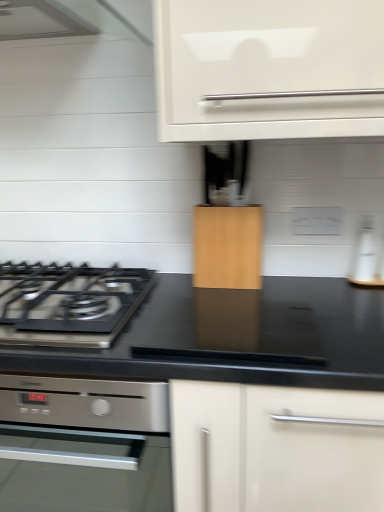
This screenshot has width=384, height=512. Describe the element at coordinates (228, 247) in the screenshot. I see `wooden cabinet at center` at that location.

What are the coordinates of `white glossy bottle at right` in the screenshot? It's located at (365, 258).

Locate an element on the screen. black matte gas stove at left is located at coordinates (68, 303).

Find the location of a particular element. Image resolution: width=384 pixels, height=512 pixels. wooden cabinet at center is located at coordinates (228, 247).

Looking at the image, does black matte gas stove at left seem bigger or smaller compared to white glossy bottle at right?

In the image, black matte gas stove at left appears to be larger than white glossy bottle at right.

Is black matte gas stove at left positioned in front of white glossy bottle at right?

Yes, the depth of black matte gas stove at left is less than that of white glossy bottle at right.

From the image's perspective, which object appears higher, black matte gas stove at left or white glossy bottle at right?

From the image's view, white glossy bottle at right is above.

This screenshot has width=384, height=512. I want to click on kitchen appliance above the black matte gas stove at left (from the image's perspective), so click(x=365, y=258).

Considering the relative positions of black matte gas stove at left and wooden cabinet at center in the image provided, is black matte gas stove at left to the left or to the right of wooden cabinet at center?

black matte gas stove at left is to the left of wooden cabinet at center.

Is black matte gas stove at left next to wooden cabinet at center and touching it?

No, black matte gas stove at left is not touching wooden cabinet at center.

Is black matte gas stove at left aimed at wooden cabinet at center?

No, black matte gas stove at left is not oriented towards wooden cabinet at center.

Can we say black matte gas stove at left lies outside wooden cabinet at center?

Yes, black matte gas stove at left is not within wooden cabinet at center.

Between satin silver oven at lower left and black matte gas stove at left, which one has larger size?

satin silver oven at lower left.

Is satin silver oven at lower left facing away from black matte gas stove at left?

No, black matte gas stove at left is not at the back of satin silver oven at lower left.

Does satin silver oven at lower left have a lesser height compared to black matte gas stove at left?

No.

From the image's perspective, is satin silver oven at lower left above or below black matte gas stove at left?

Result: Based on their image positions, satin silver oven at lower left is located beneath black matte gas stove at left.

Is satin silver oven at lower left at the back of wooden cabinet at center?

wooden cabinet at center is not turned away from satin silver oven at lower left.

From the image's perspective, which is above, wooden cabinet at center or satin silver oven at lower left?

From the image's view, wooden cabinet at center is above.

Considering the sizes of wooden cabinet at center and satin silver oven at lower left in the image, is wooden cabinet at center bigger or smaller than satin silver oven at lower left?

Clearly, wooden cabinet at center is smaller in size than satin silver oven at lower left.

Considering the points (243, 236) and (43, 502), which point is in front, point (243, 236) or point (43, 502)?

The point (243, 236) is closer to the camera.

Which object is closer to the camera taking this photo, white glossy bottle at right or wooden cabinet at center?

wooden cabinet at center is in front.

Between white glossy bottle at right and wooden cabinet at center, which one appears on the right side from the viewer's perspective?

Positioned to the right is white glossy bottle at right.

Consider the image. Considering the sizes of objects white glossy bottle at right and wooden cabinet at center in the image provided, who is wider, white glossy bottle at right or wooden cabinet at center?

wooden cabinet at center.

Is white glossy bottle at right not near wooden cabinet at center?

No, there isn't a large distance between white glossy bottle at right and wooden cabinet at center.

Looking at their sizes, would you say satin silver oven at lower left is wider or thinner than wooden cabinet at center?

satin silver oven at lower left is wider than wooden cabinet at center.

Which of these two, satin silver oven at lower left or wooden cabinet at center, is bigger?

With larger size is satin silver oven at lower left.

Could wooden cabinet at center be considered to be inside satin silver oven at lower left?

Actually, wooden cabinet at center is outside satin silver oven at lower left.

From a real-world perspective, is satin silver oven at lower left below wooden cabinet at center?

Yes, from a real-world perspective, satin silver oven at lower left is beneath wooden cabinet at center.

From a real-world perspective, which object stands above the other?

From a 3D spatial view, white glossy bottle at right is above.

Image resolution: width=384 pixels, height=512 pixels. In order to click on home appliance below the white glossy bottle at right (from the image's perspective) in this screenshot , I will do 84,445.

How far apart are satin silver oven at lower left and white glossy bottle at right?

The distance of satin silver oven at lower left from white glossy bottle at right is 1.20 meters.

Is satin silver oven at lower left aimed at white glossy bottle at right?

No, satin silver oven at lower left is not turned towards white glossy bottle at right.

The width and height of the screenshot is (384, 512). I want to click on kitchen appliance above the black matte gas stove at left (from the image's perspective), so click(x=365, y=258).

Where is `cabinetry above the black matte gas stove at left (from a real-world perspective)`? This screenshot has width=384, height=512. cabinetry above the black matte gas stove at left (from a real-world perspective) is located at coordinates (228, 247).

Based on their spatial positions, is wooden cabinet at center or satin silver oven at lower left closer to black matte gas stove at left?

Based on the image, wooden cabinet at center appears to be nearer to black matte gas stove at left.

In the scene shown: Which object lies further to the anchor point wooden cabinet at center, satin silver oven at lower left or black matte gas stove at left?

Based on the image, satin silver oven at lower left appears to be further to wooden cabinet at center.

Estimate the real-world distances between objects in this image. Which object is further from white glossy bottle at right, satin silver oven at lower left or black matte gas stove at left?

satin silver oven at lower left is further to white glossy bottle at right.

Consider the image. Which object lies further to the anchor point satin silver oven at lower left, white glossy bottle at right or wooden cabinet at center?

white glossy bottle at right is positioned further to the anchor satin silver oven at lower left.

Considering their positions, is black matte gas stove at left positioned closer to white glossy bottle at right than satin silver oven at lower left?

black matte gas stove at left is positioned closer to the anchor white glossy bottle at right.

When comparing their distances from satin silver oven at lower left, does white glossy bottle at right or black matte gas stove at left seem closer?

The object closer to satin silver oven at lower left is black matte gas stove at left.

From the picture: When comparing their distances from white glossy bottle at right, does satin silver oven at lower left or wooden cabinet at center seem further?

Based on the image, satin silver oven at lower left appears to be further to white glossy bottle at right.

From the image, which object appears to be farther from black matte gas stove at left, white glossy bottle at right or wooden cabinet at center?

white glossy bottle at right is further to black matte gas stove at left.

Where is `cabinetry between satin silver oven at lower left and white glossy bottle at right from left to right`? This screenshot has height=512, width=384. cabinetry between satin silver oven at lower left and white glossy bottle at right from left to right is located at coordinates (228, 247).

Locate an element on the screen. This screenshot has width=384, height=512. home appliance between black matte gas stove at left and white glossy bottle at right is located at coordinates (84, 445).

You are a GUI agent. You are given a task and a screenshot of the screen. Output one action in this format:
    pyautogui.click(x=<x>, y=<y>)
    Task: Click on the cabinetry between black matte gas stove at left and white glossy bottle at right in the horizontal direction
    The image size is (384, 512).
    Given the screenshot: What is the action you would take?
    pyautogui.click(x=228, y=247)

I want to click on gas stove between wooden cabinet at center and satin silver oven at lower left in the up-down direction, so click(x=68, y=303).